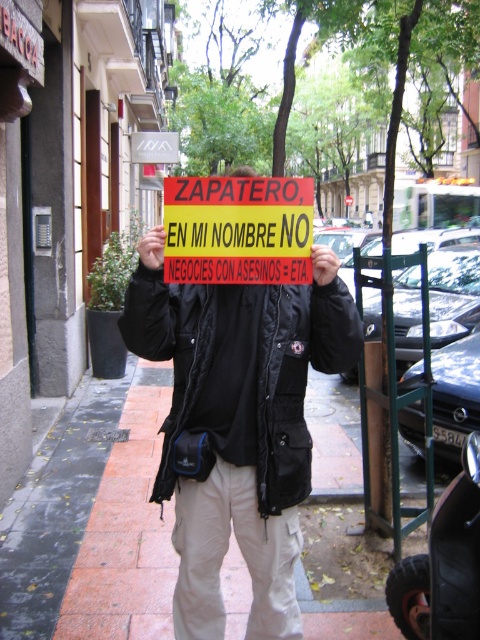
Can you confirm if black fabric jacket at center is shorter than yellow paper sign at center?

Incorrect, black fabric jacket at center's height does not fall short of yellow paper sign at center's.

Does black fabric jacket at center have a greater width compared to yellow paper sign at center?

Yes.

Between point (298, 300) and point (168, 248), which one is positioned behind?

Point (298, 300)

This screenshot has height=640, width=480. I want to click on black fabric jacket at center, so click(x=238, y=424).